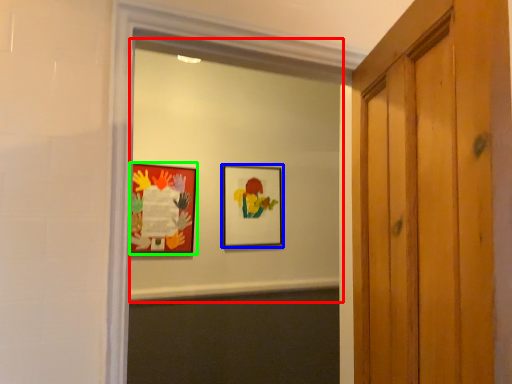
Question: Which object is the closest to the mirror (highlighted by a red box)? Choose among these: picture frame (highlighted by a blue box) or picture frame (highlighted by a green box).

Choices:
 (A) picture frame
 (B) picture frame

Answer: (A)